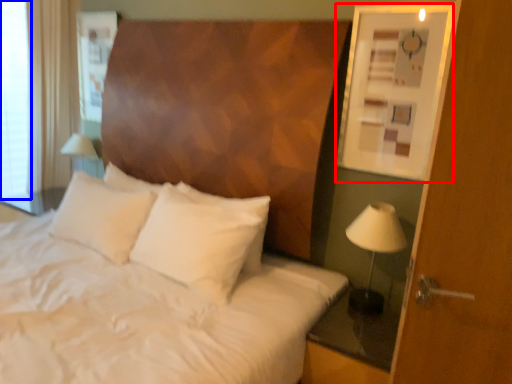
Question: Which object appears farthest to the camera in this image, picture frame (highlighted by a red box) or window screen (highlighted by a blue box)?

Choices:
 (A) picture frame
 (B) window screen

Answer: (B)